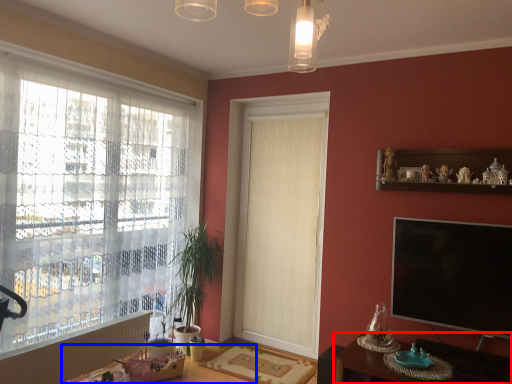
Question: Which point is further to the camera, table (highlighted by a red box) or round table (highlighted by a blue box)?

Choices:
 (A) table
 (B) round table

Answer: (B)